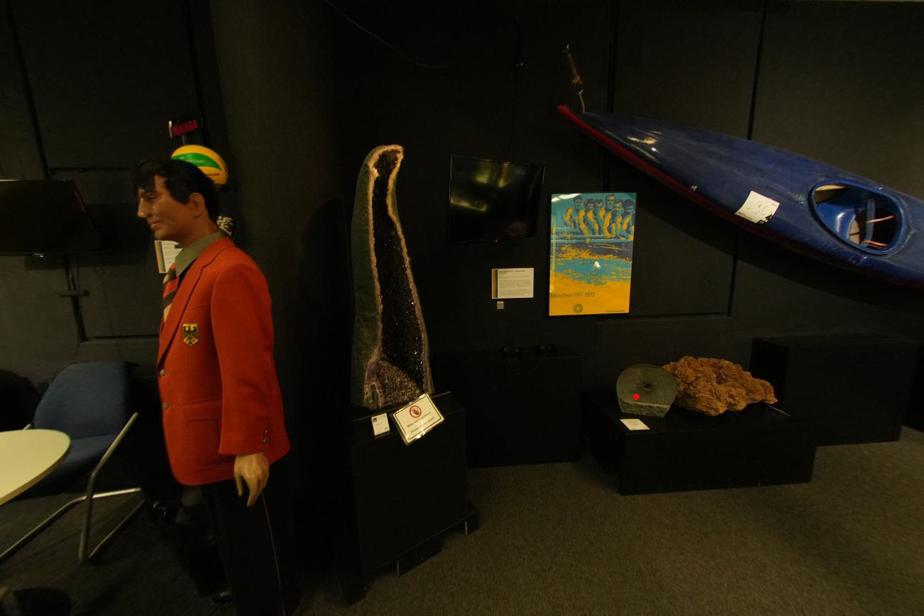
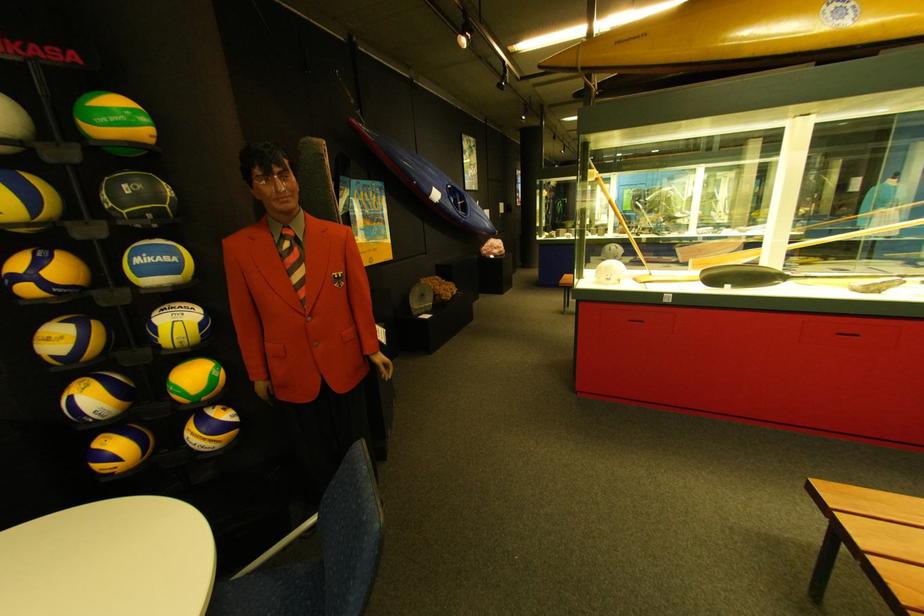
The point at the highlighted location is marked in the first image. Where is the corresponding point in the second image?

(427, 307)